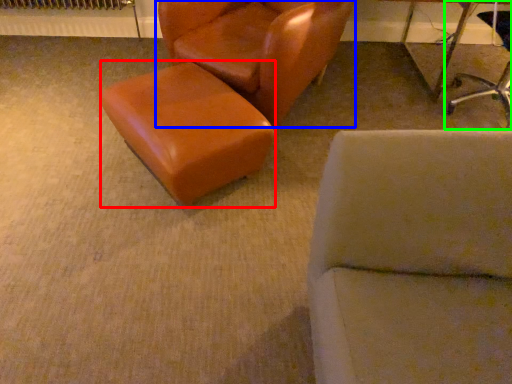
Question: Estimate the real-world distances between objects in this image. Which object is farther from stool (highlighted by a red box), chair (highlighted by a blue box) or chair (highlighted by a green box)?

Choices:
 (A) chair
 (B) chair

Answer: (B)